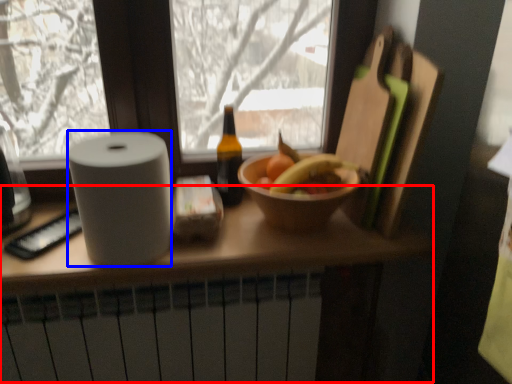
Question: Which object appears farthest to the camera in this image, counter (highlighted by a red box) or paper towel (highlighted by a blue box)?

Choices:
 (A) counter
 (B) paper towel

Answer: (A)